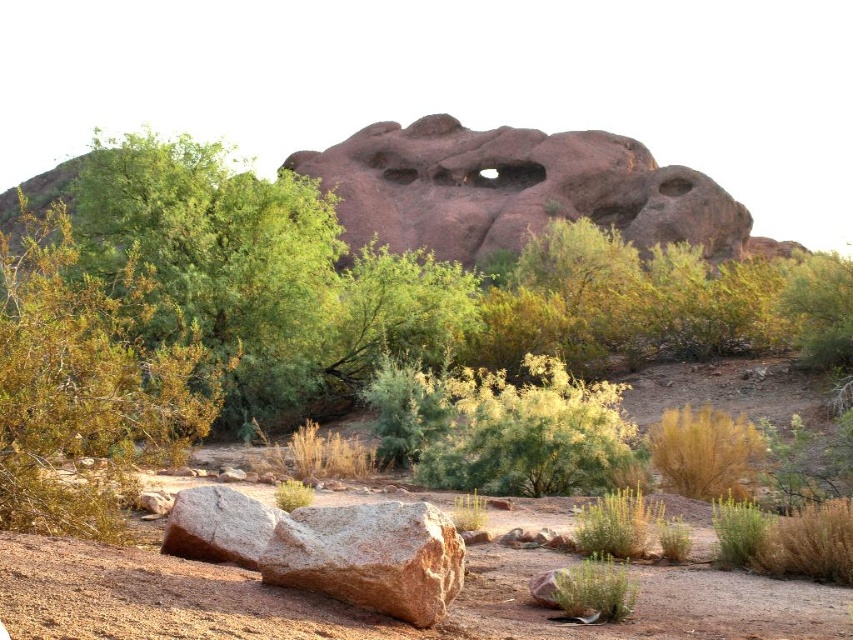
You are standing at the center of the desert scene. There is a green leafy bush at left located at point (x=86, y=384). If you want to walk directly towards the green leafy bush at left, which direction should you head?

The green leafy bush at left is located at point (x=86, y=384), so you should head towards the left direction to reach it.

You are a geologist examining the desert landscape. You need to determine which object, the rusty brown rock at center or the brown rough boulder at lower left, would be more suitable for testing erosion patterns. Based on their sizes, which one might you choose and why?

The rusty brown rock at center is larger in size than the brown rough boulder at lower left, so the rusty brown rock at center would be more suitable for testing erosion patterns as its larger size provides more surface area and material to analyze.